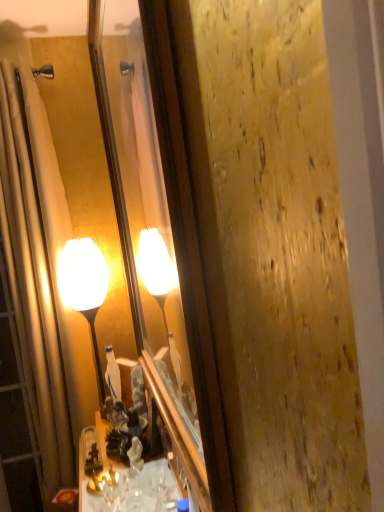
Image resolution: width=384 pixels, height=512 pixels. In order to click on blank space above shiny brass cabinet at lower center (from a real-world perspective) in this screenshot , I will do `click(124, 484)`.